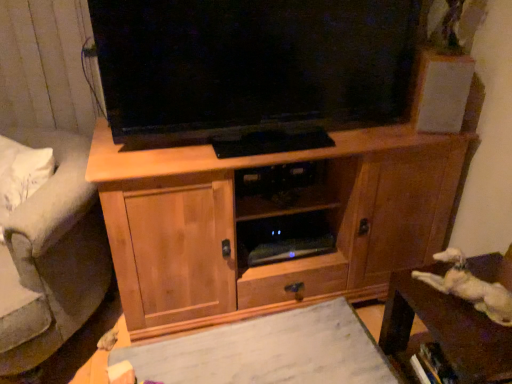
Question: Is the depth of gray fabric armchair at left greater than that of white matte paper at center?

Choices:
 (A) no
 (B) yes

Answer: (A)

Question: Could white matte paper at center be considered to be inside gray fabric armchair at left?

Choices:
 (A) yes
 (B) no

Answer: (B)

Question: Is gray fabric armchair at left at the left side of white matte paper at center?

Choices:
 (A) yes
 (B) no

Answer: (A)

Question: Is gray fabric armchair at left to the right of white matte paper at center from the viewer's perspective?

Choices:
 (A) no
 (B) yes

Answer: (A)

Question: Considering the relative sizes of gray fabric armchair at left and white matte paper at center in the image provided, is gray fabric armchair at left shorter than white matte paper at center?

Choices:
 (A) no
 (B) yes

Answer: (A)

Question: From the image's perspective, would you say gray fabric armchair at left is shown under white matte paper at center?

Choices:
 (A) yes
 (B) no

Answer: (B)

Question: From the image's perspective, is brown wooden table at lower right under white matte paper at center?

Choices:
 (A) no
 (B) yes

Answer: (A)

Question: Is the depth of brown wooden table at lower right greater than that of white matte paper at center?

Choices:
 (A) no
 (B) yes

Answer: (A)

Question: Does brown wooden table at lower right have a lesser height compared to white matte paper at center?

Choices:
 (A) yes
 (B) no

Answer: (B)

Question: Is brown wooden table at lower right closer to the viewer compared to white matte paper at center?

Choices:
 (A) no
 (B) yes

Answer: (B)

Question: Can we say brown wooden table at lower right lies outside white matte paper at center?

Choices:
 (A) no
 (B) yes

Answer: (B)

Question: From a real-world perspective, is brown wooden table at lower right beneath white matte paper at center?

Choices:
 (A) no
 (B) yes

Answer: (A)

Question: Can you confirm if gray fabric armchair at left is shorter than white matte speaker at upper right?

Choices:
 (A) yes
 (B) no

Answer: (B)